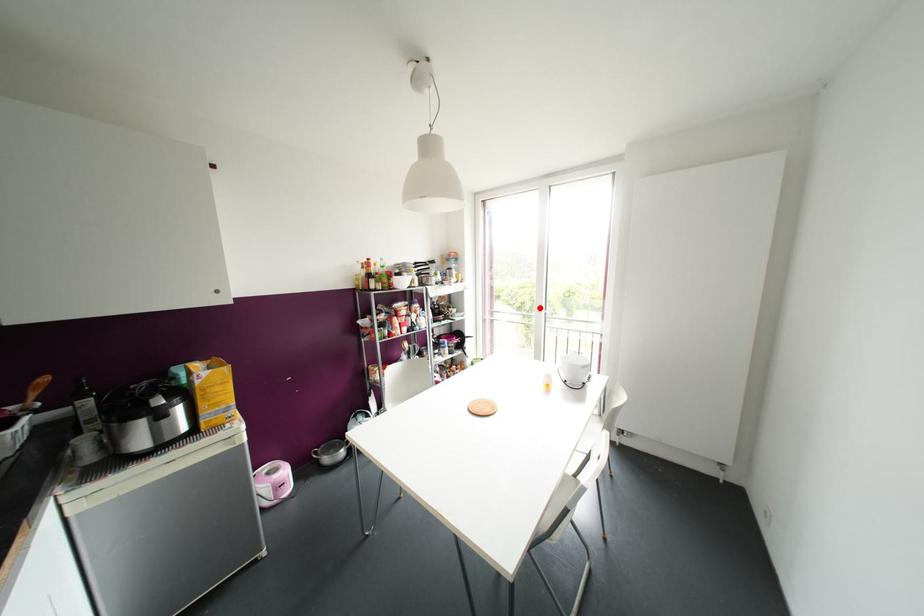
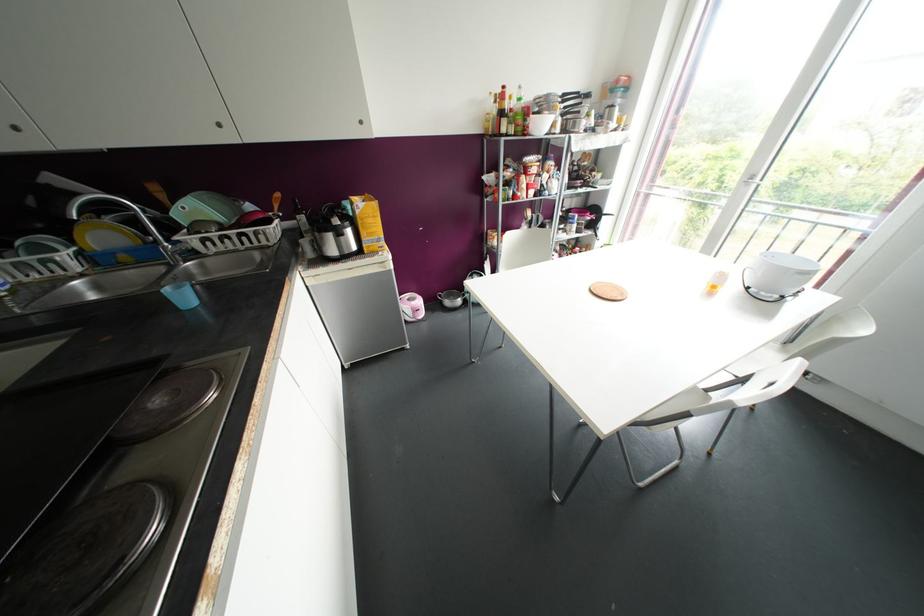
Question: I am providing you with two images of the same scene from different viewpoints. A red point is marked on the first image. Can you still see the location of the red point in image 2?

Choices:
 (A) Yes
 (B) No

Answer: (A)